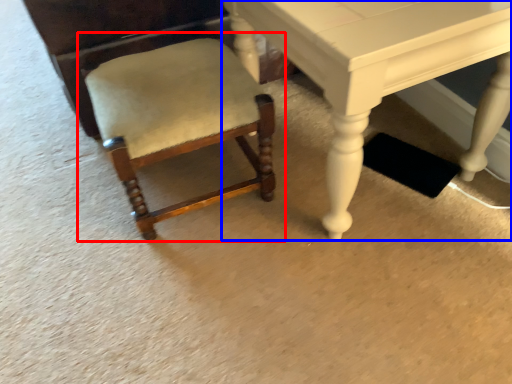
Question: Which object is closer to the camera taking this photo, chair (highlighted by a red box) or table (highlighted by a blue box)?

Choices:
 (A) chair
 (B) table

Answer: (B)